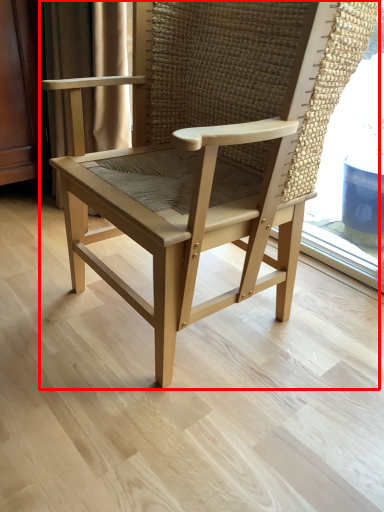
Question: From the image, what is the correct spatial relationship of chair (annotated by the red box) in relation to curtain?

Choices:
 (A) left
 (B) right

Answer: (B)